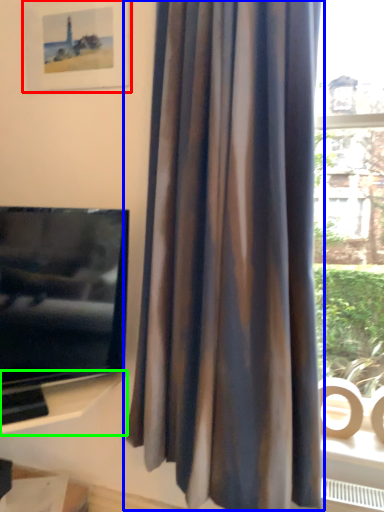
Question: Which is nearer to the picture frame (highlighted by a red box)? curtain (highlighted by a blue box) or shelf (highlighted by a green box).

Choices:
 (A) curtain
 (B) shelf

Answer: (A)